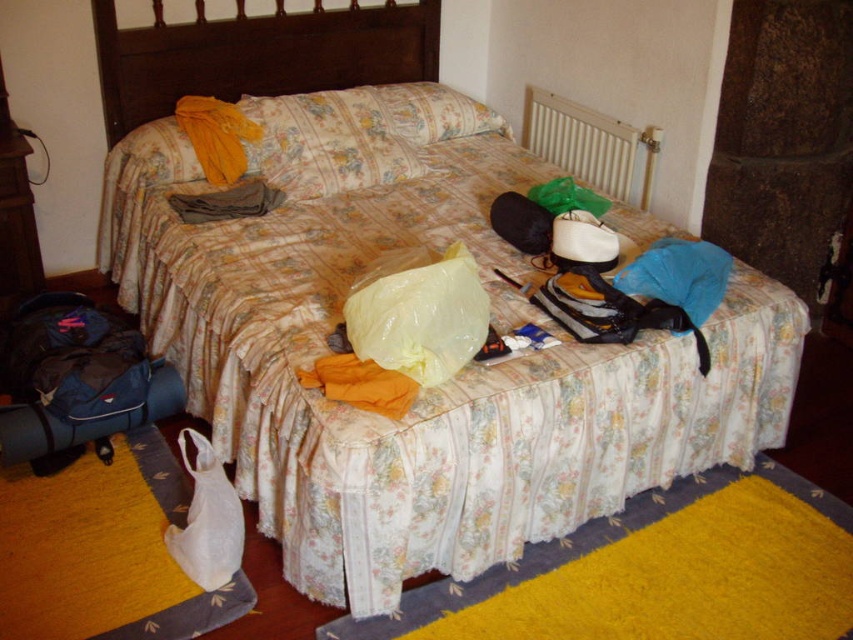
You are organizing the bedroom and need to place items on a shelf that can only hold items narrower than the floral fabric pillow at center. Can the white plastic bag at lower left fit on the shelf?

The white plastic bag at lower left has a width less than the floral fabric pillow at center, so it can fit on the shelf.

From the picture: You are organizing your bedroom and need to place a new item on the floor. The white plastic bag at lower left and the wooden dresser at left are both in your way. Which object has a larger width?

The white plastic bag at lower left has a larger width than the wooden dresser at left according to the description.